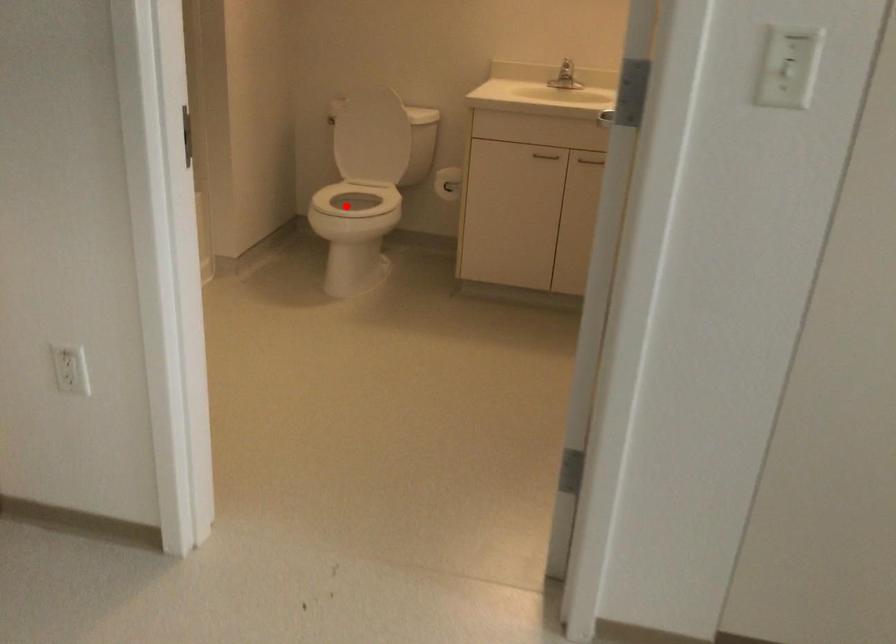
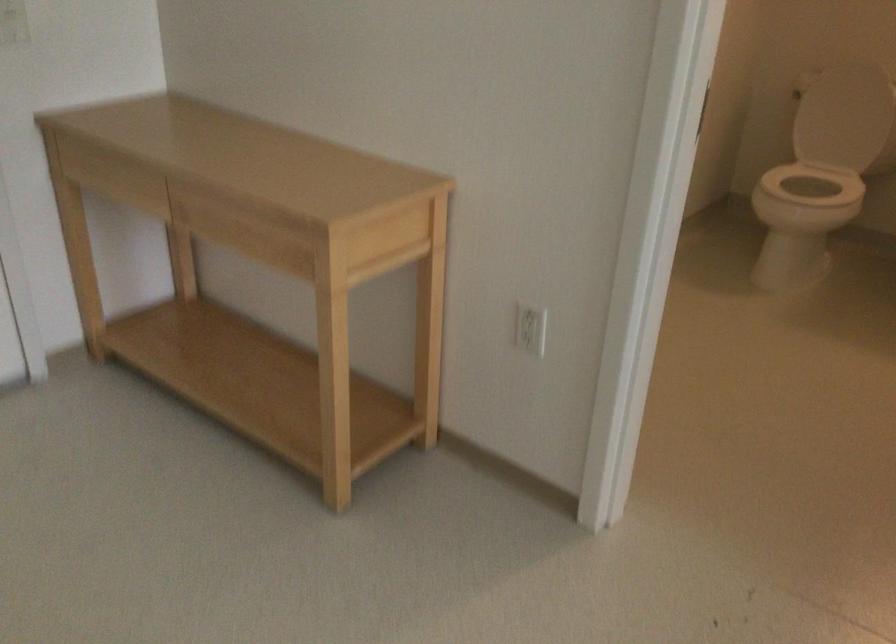
Question: A red point is marked in image1. In image2, is the corresponding 3D point closer to the camera or farther? Reply with the corresponding letter.

Choices:
 (A) The corresponding 3D point is closer.
 (B) The corresponding 3D point is farther.

Answer: (A)